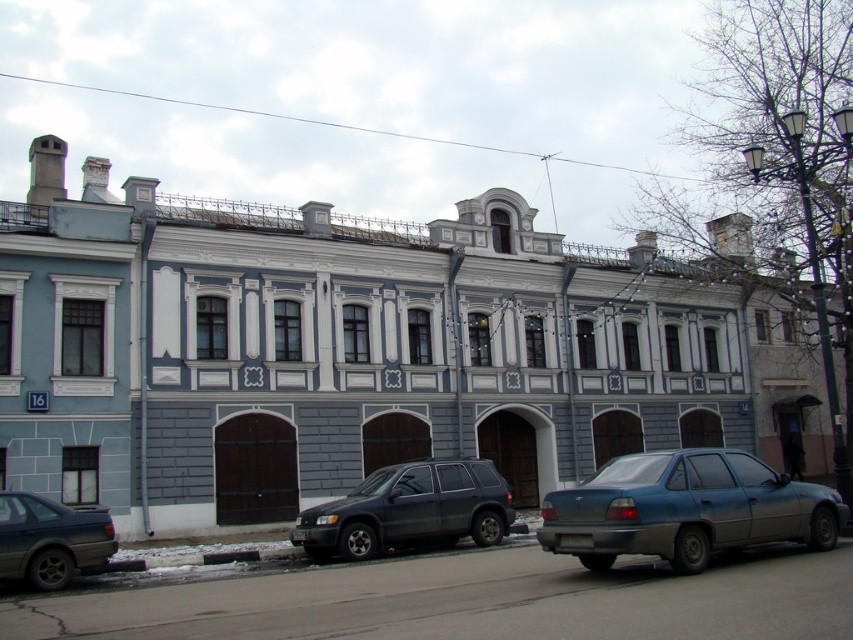
You are a tourist standing in front of the historic buildings and see both the metallic gray sedan at lower right and the matte black sedan at lower left. Which car is positioned lower in the image?

The metallic gray sedan at lower right is positioned lower in the image than the matte black sedan at lower left.

You are a delivery driver who needs to park your truck in the parking lot behind the historic buildings. However, there are already two vehicles present. Can you estimate whether there is enough space between the metallic gray sedan at lower right and the matte dark gray suv at center to fit your truck, which is 7 meters long?

The metallic gray sedan at lower right is positioned over the matte dark gray suv at center. This means the sedan is parked directly in front of or overlapping the SUV, leaving no space between them. Therefore, there is insufficient space to fit a 7 meter long truck between them.

You are a delivery driver who needs to park your truck between the matte dark gray suv at center and the matte black sedan at lower left. Your truck is 10 meters long. Is there enough space between them to park your truck?

The distance between the matte dark gray suv at center and the matte black sedan at lower left is 9.52 meters. Since your truck is 10 meters long, there isn not enough space to park between them.